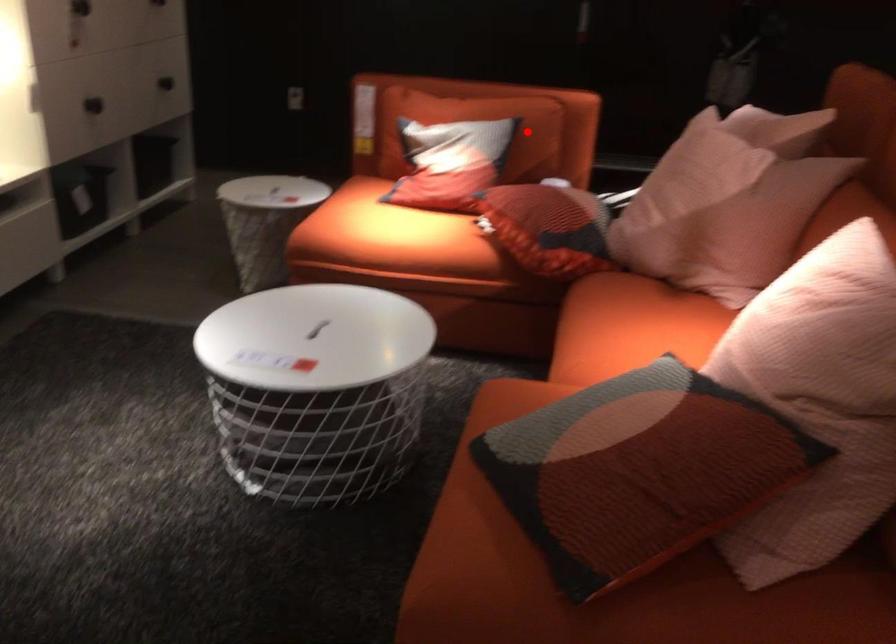
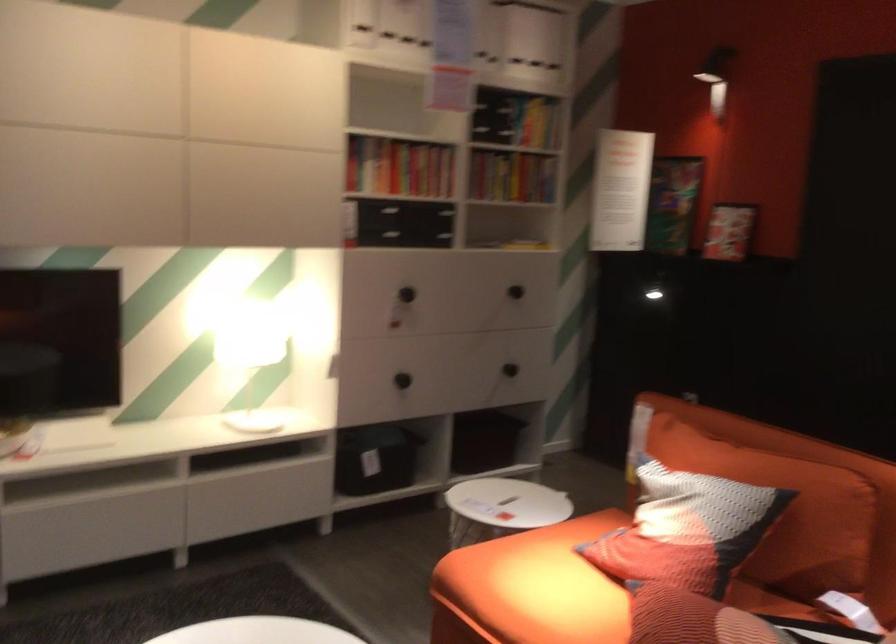
Locate, in the second image, the point that corresponds to the highlighted location in the first image.

(785, 511)